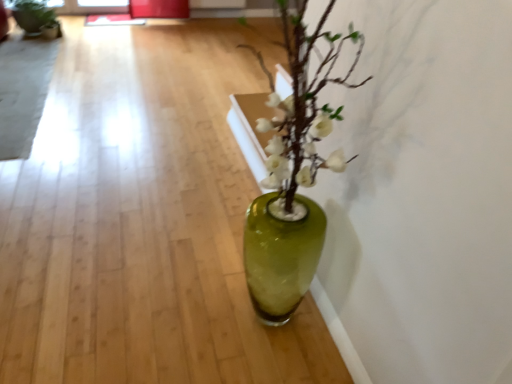
Question: From the image's perspective, is matte black pot at upper left positioned above or below translucent glass vase at center?

Choices:
 (A) above
 (B) below

Answer: (A)

Question: Would you say matte black pot at upper left is to the left or to the right of translucent glass vase at center in the picture?

Choices:
 (A) right
 (B) left

Answer: (B)

Question: Estimate the real-world distances between objects in this image. Which object is farther from the matte black pot at upper left?

Choices:
 (A) green glass vase at center
 (B) translucent glass vase at center

Answer: (B)

Question: Estimate the real-world distances between objects in this image. Which object is farther from the translucent glass vase at center?

Choices:
 (A) matte black pot at upper left
 (B) green glass vase at center

Answer: (A)